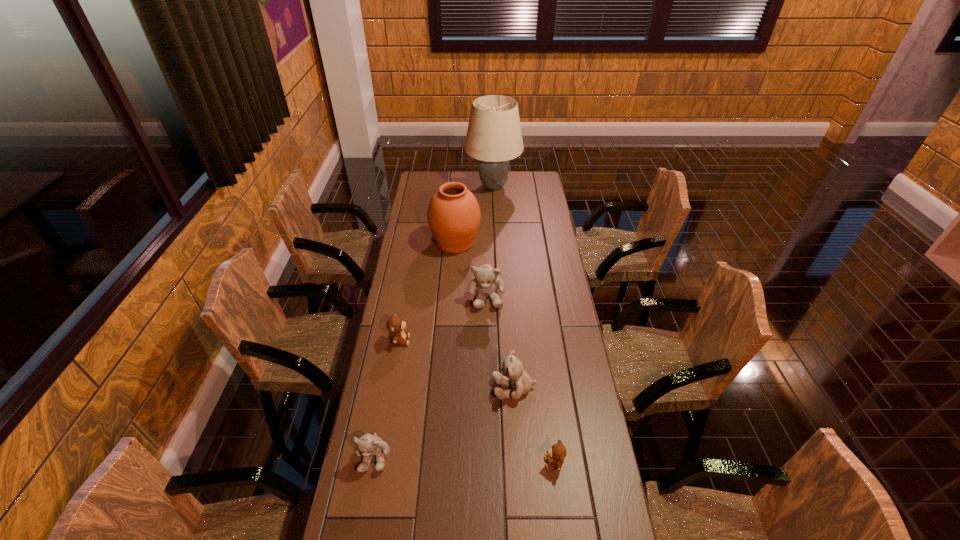
Locate an element on the screen. The width and height of the screenshot is (960, 540). vacant space at the far edge of the desktop is located at coordinates (510, 171).

This screenshot has width=960, height=540. What are the coordinates of `vacant space at the left edge` in the screenshot? It's located at (412, 303).

Identify the location of vacant region at the right edge of the desktop. (566, 286).

Image resolution: width=960 pixels, height=540 pixels. In order to click on vacant area at the far left corner in this screenshot , I will do `click(418, 193)`.

Locate an element on the screen. Image resolution: width=960 pixels, height=540 pixels. free location at the far right corner is located at coordinates (525, 189).

The width and height of the screenshot is (960, 540). What are the coordinates of `free space between the second tallest teddy bear and the bigger brown teddy bear` in the screenshot? It's located at (457, 364).

The width and height of the screenshot is (960, 540). I want to click on free area in between the smallest gray teddy bear and the left brown teddy bear, so click(x=387, y=398).

What are the coordinates of `free spot between the sixth nearest object and the left brown teddy bear` in the screenshot? It's located at (427, 292).

The height and width of the screenshot is (540, 960). I want to click on free spot between the nearer brown teddy bear and the fourth shortest object, so click(534, 426).

Where is `free spot between the farthest object and the smaller brown teddy bear`? free spot between the farthest object and the smaller brown teddy bear is located at coordinates (523, 325).